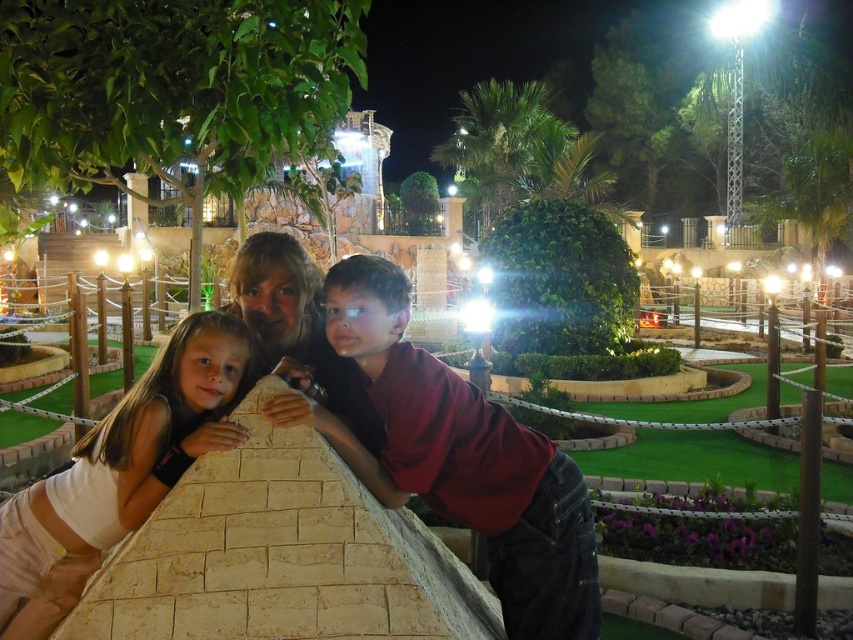
Does maroon fabric shirt at center have a smaller size compared to matte red shirt at center?

Incorrect, maroon fabric shirt at center is not smaller in size than matte red shirt at center.

Which is more to the left, maroon fabric shirt at center or matte red shirt at center?

matte red shirt at center

I want to click on maroon fabric shirt at center, so click(x=462, y=458).

Who is more forward, (163,365) or (293,282)?

Point (163,365)

Consider the image. Is white matte shirt at center further to the viewer compared to matte red shirt at center?

Yes, white matte shirt at center is behind matte red shirt at center.

Locate an element on the screen. Image resolution: width=853 pixels, height=640 pixels. white matte shirt at center is located at coordinates (119, 472).

The width and height of the screenshot is (853, 640). I want to click on white matte shirt at center, so click(119, 472).

Is point (398, 269) less distant than point (33, 570)?

No, (398, 269) is behind (33, 570).

Is maroon fabric shirt at center closer to the viewer compared to white matte shirt at center?

Yes, maroon fabric shirt at center is closer to the viewer.

Between point (424, 449) and point (73, 480), which one is positioned in front?

Point (73, 480) is in front.

The image size is (853, 640). Find the location of `maroon fabric shirt at center`. maroon fabric shirt at center is located at coordinates 462,458.